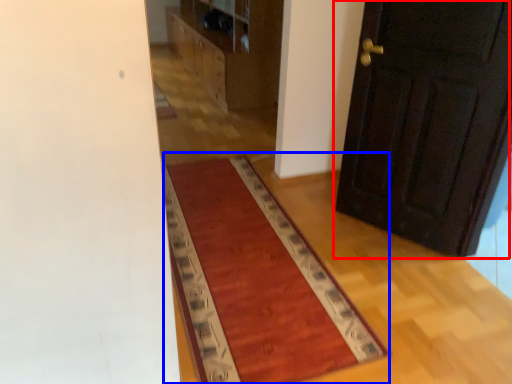
Question: Which object is closer to the camera taking this photo, door (highlighted by a red box) or mat (highlighted by a blue box)?

Choices:
 (A) door
 (B) mat

Answer: (B)